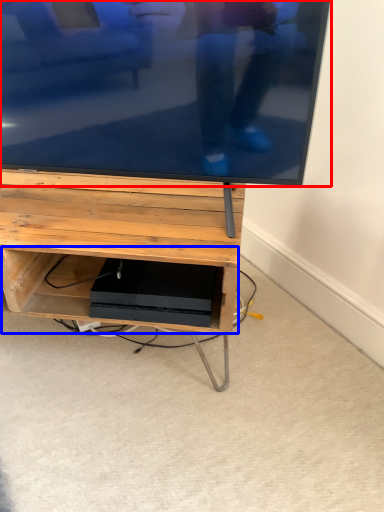
Question: Which object appears farthest to the camera in this image, television (highlighted by a red box) or shelf (highlighted by a blue box)?

Choices:
 (A) television
 (B) shelf

Answer: (B)